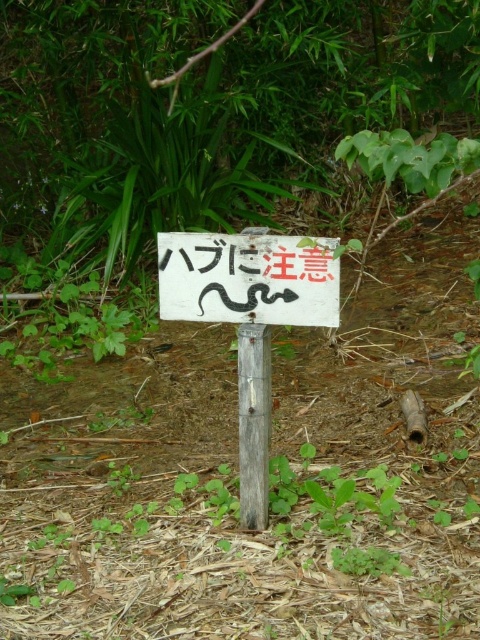
From the picture: You are hiking in the forest and come across the white matte sign at center and the weathered wood post at center. According to the scene, which object is placed above the other?

The white matte sign at center is positioned over the weathered wood post at center, so it is placed above the post.

You are hiking in a forest and come across a signpost. You see the white wooden sign at center and the weathered wood post at center. Which object is located to the left of the other?

The white wooden sign at center is positioned on the left side of weathered wood post at center.

You are walking along a forest path and see two points marked in the image. The first point is at coordinates point (249,477) and the second is at point (262,518). Which point is closer to you as you face the signpost?

Point (249,477) is closer to you because it is in front of point (262,518).